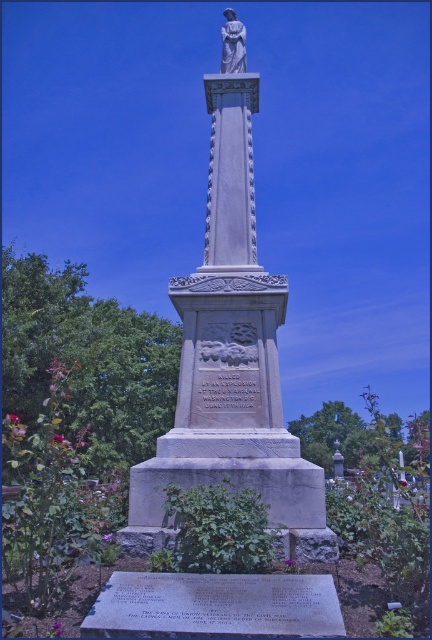
What are the coordinates of the gray stone monument at center in the image?

The coordinates of the gray stone monument at center are at point (x=231, y=364).

You are a historian examining the gray stone monument at center and the white marble statue at upper center. Which object would require a taller ladder to reach its top for inspection?

The white marble statue at upper center requires a taller ladder because it is larger in size than the gray stone monument at center.

What is the spatial relationship between the gray stone monument at center and the white marble statue at upper center?

The gray stone monument at center is located below the white marble statue at upper center.